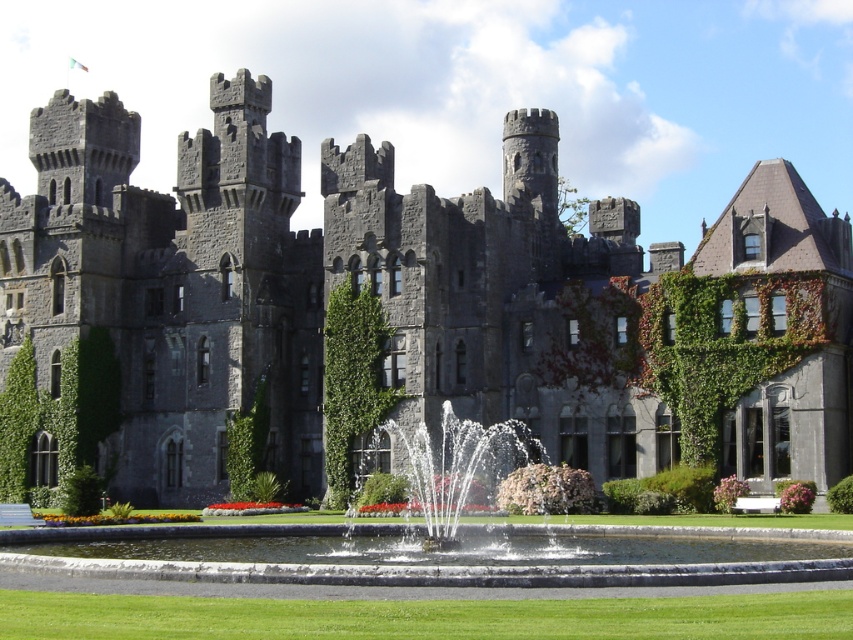
You are a gardener tasked with maintaining the green grass at lower center and the white water at center in the castle grounds. Which area requires more space for your equipment to operate comfortably?

The white water at center requires more space because the green grass at lower center is smaller than the white water at center, indicating the water area is larger.

Consider the image. You are a knight standing at the castle entrance. You want to walk from the entrance to the white water at center to retrieve a dropped item. However, there is a green leafy ivy at center blocking your path. Can you safely walk around the ivy to reach the water without getting too close to it?

The distance between the white water at center and the green leafy ivy at center is 5.61 meters. Since the ivy is blocking your path but is 5.61 meters away from the water, you can safely walk around it while maintaining a safe distance.

You are a gardener tasked with trimming plants in the castle courtyard. You have two plants to trim today. The first is the green grass at lower center, and the second is the green leafy ivy at center. Which plant will require a taller ladder to reach its top?

The green leafy ivy at center is taller than the green grass at lower center, so you will need a taller ladder for the green leafy ivy at center.